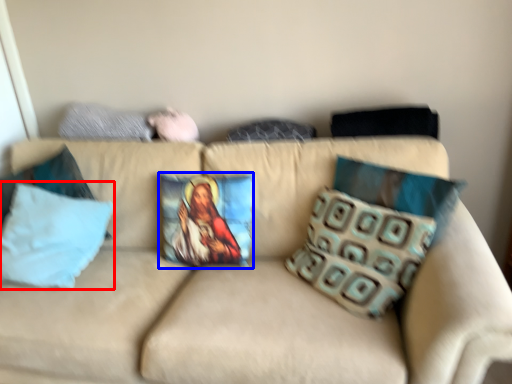
Question: Which of the following is the farthest to the observer, pillow (highlighted by a red box) or pillow (highlighted by a blue box)?

Choices:
 (A) pillow
 (B) pillow

Answer: (B)